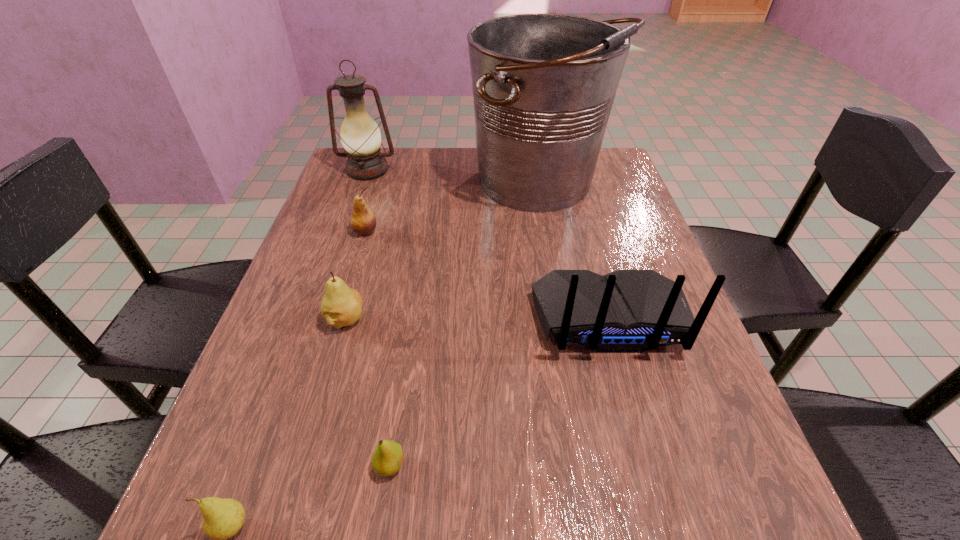
Find the location of a particular element. The height and width of the screenshot is (540, 960). free area in between the bucket and the third tallest object is located at coordinates (575, 251).

Identify the location of vacant area between the bucket and the router. The image size is (960, 540). (575, 251).

The height and width of the screenshot is (540, 960). In order to click on empty space between the farthest pear and the second nearest object in this screenshot , I will do `click(377, 348)`.

Locate an element on the screen. The height and width of the screenshot is (540, 960). free space that is in between the rightmost pear and the oil lamp is located at coordinates (378, 318).

Select which object is the fifth closest to the sixth shortest object. Please provide its 2D coordinates. Your answer should be formatted as a tuple, i.e. [(x, y)], where the tuple contains the x and y coordinates of a point satisfying the conditions above.

[(387, 458)]

Locate which object is the third closest to the router. Please provide its 2D coordinates. Your answer should be formatted as a tuple, i.e. [(x, y)], where the tuple contains the x and y coordinates of a point satisfying the conditions above.

[(341, 306)]

Choose which pear is the nearest neighbor to the third farthest pear. Please provide its 2D coordinates. Your answer should be formatted as a tuple, i.e. [(x, y)], where the tuple contains the x and y coordinates of a point satisfying the conditions above.

[(222, 518)]

Identify the location of pear object that ranks as the closest to the nearest object. (387, 458).

The width and height of the screenshot is (960, 540). Identify the location of free space in the image that satisfies the following two spatial constraints: 1. on the back side of the bucket; 2. on the right side of the farthest pear. (380, 184).